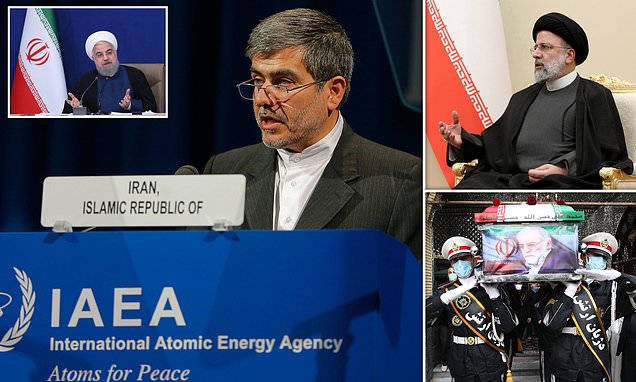
The width and height of the screenshot is (636, 382). What are the coordinates of `table` in the screenshot? It's located at (201, 282).